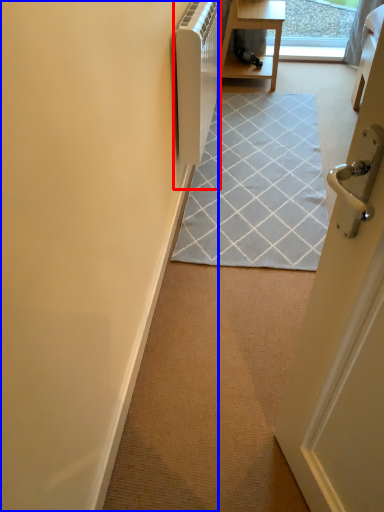
Question: Which object appears closest to the camera in this image, appliance (highlighted by a red box) or door (highlighted by a blue box)?

Choices:
 (A) appliance
 (B) door

Answer: (B)